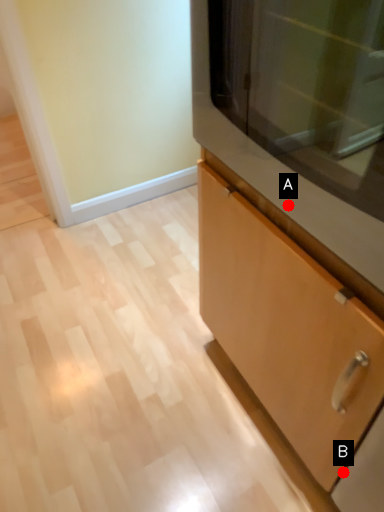
Question: Two points are circled on the image, labeled by A and B beside each circle. Which point is further to the camera?

Choices:
 (A) A is further
 (B) B is further

Answer: (B)